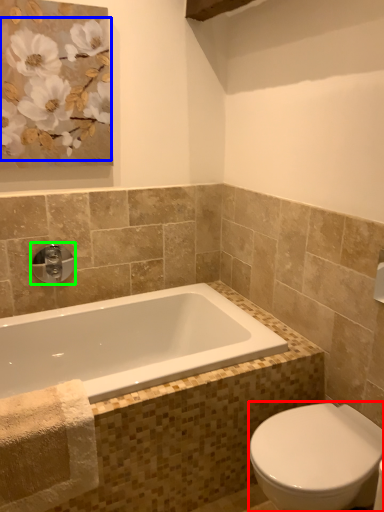
Question: Which is nearer to the bidet (highlighted by a red box)? flower (highlighted by a blue box) or tap (highlighted by a green box).

Choices:
 (A) flower
 (B) tap

Answer: (B)